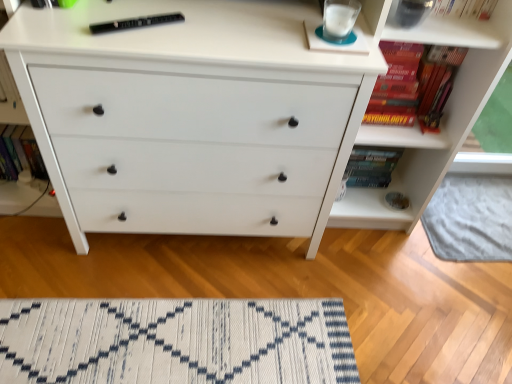
The width and height of the screenshot is (512, 384). In order to click on vacant space behind black plastic remote at upper center, the third book viewed from the right in this screenshot , I will do `click(159, 11)`.